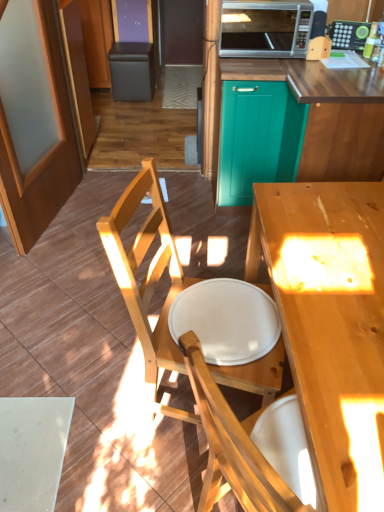
Question: Is wooden screen door at left, the first screen door positioned from the left, closer to the viewer compared to green plastic microwave at upper center?

Choices:
 (A) yes
 (B) no

Answer: (A)

Question: Can you confirm if wooden screen door at left, the first screen door positioned from the left, is bigger than green plastic microwave at upper center?

Choices:
 (A) no
 (B) yes

Answer: (B)

Question: Is wooden screen door at left, the first screen door positioned from the left, positioned with its back to green plastic microwave at upper center?

Choices:
 (A) no
 (B) yes

Answer: (A)

Question: Does wooden screen door at left, placed as the second screen door when sorted from right to left, have a smaller size compared to green plastic microwave at upper center?

Choices:
 (A) yes
 (B) no

Answer: (B)

Question: From the image's perspective, is wooden screen door at left, placed as the second screen door when sorted from right to left, above green plastic microwave at upper center?

Choices:
 (A) no
 (B) yes

Answer: (A)

Question: Is wooden screen door at left, the first screen door positioned from the left, in contact with green plastic microwave at upper center?

Choices:
 (A) yes
 (B) no

Answer: (B)

Question: From the image's perspective, is green plastic microwave at upper center located above silver metallic microwave at upper center?

Choices:
 (A) yes
 (B) no

Answer: (A)

Question: Is green plastic microwave at upper center shorter than silver metallic microwave at upper center?

Choices:
 (A) no
 (B) yes

Answer: (B)

Question: Would you say silver metallic microwave at upper center is part of green plastic microwave at upper center's contents?

Choices:
 (A) yes
 (B) no

Answer: (B)

Question: Considering the relative sizes of green plastic microwave at upper center and silver metallic microwave at upper center in the image provided, is green plastic microwave at upper center taller than silver metallic microwave at upper center?

Choices:
 (A) yes
 (B) no

Answer: (B)

Question: Is green plastic microwave at upper center positioned before silver metallic microwave at upper center?

Choices:
 (A) no
 (B) yes

Answer: (A)

Question: Can you confirm if green plastic microwave at upper center is thinner than silver metallic microwave at upper center?

Choices:
 (A) no
 (B) yes

Answer: (B)

Question: From a real-world perspective, is teal wood cabinet at upper center located higher than light wood desk at center?

Choices:
 (A) no
 (B) yes

Answer: (B)